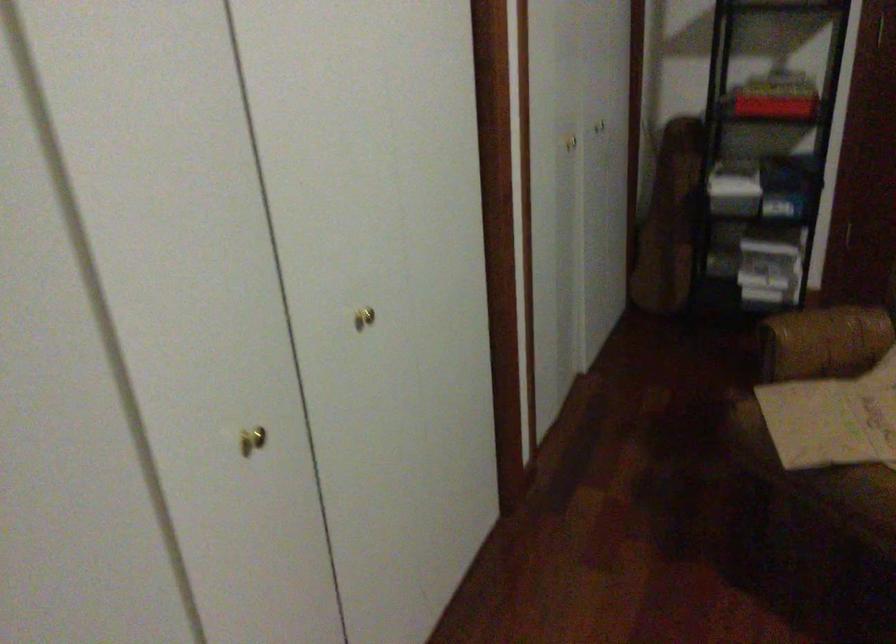
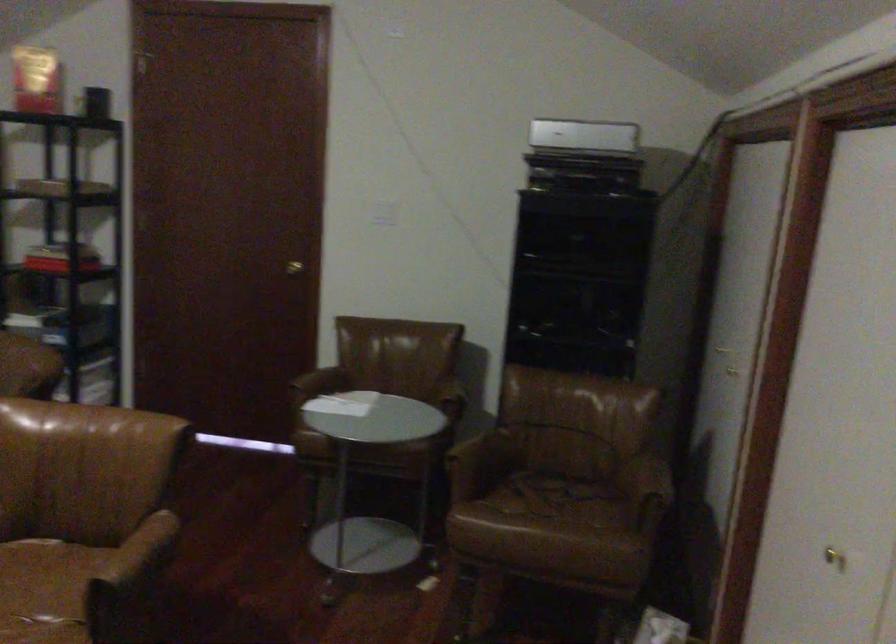
What movement of the cameraman would produce the second image?

The movement direction of the cameraman is right, backward.